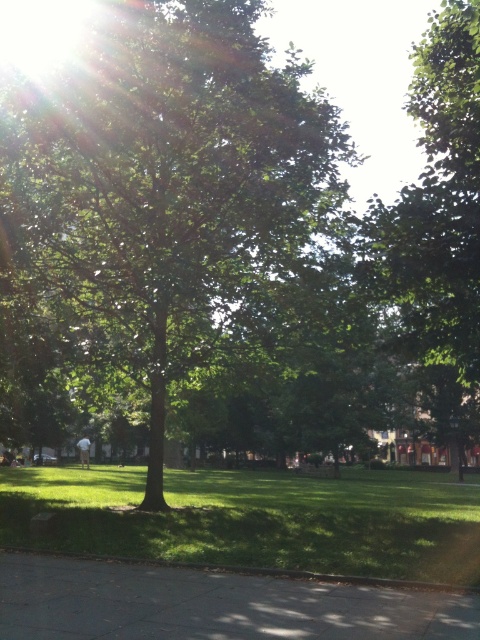
Question: Can you confirm if green leafy tree at center is positioned above green leafy tree at upper center?

Choices:
 (A) yes
 (B) no

Answer: (B)

Question: Which is nearer to the green leafy tree at center?

Choices:
 (A) gray concrete pavement at lower center
 (B) green leafy tree at upper center

Answer: (B)

Question: Which object is the closest to the green grass at lower left?

Choices:
 (A) green leafy tree at center
 (B) green leafy tree at upper center
 (C) gray concrete pavement at lower center

Answer: (A)

Question: Does gray concrete pavement at lower center appear on the left side of green leafy tree at upper center?

Choices:
 (A) no
 (B) yes

Answer: (B)

Question: Can you confirm if green grass at lower left is thinner than gray concrete pavement at lower center?

Choices:
 (A) no
 (B) yes

Answer: (A)

Question: Which object is farther from the camera taking this photo?

Choices:
 (A) gray concrete pavement at lower center
 (B) green grass at lower left
 (C) green leafy tree at upper center
 (D) green leafy tree at center

Answer: (D)